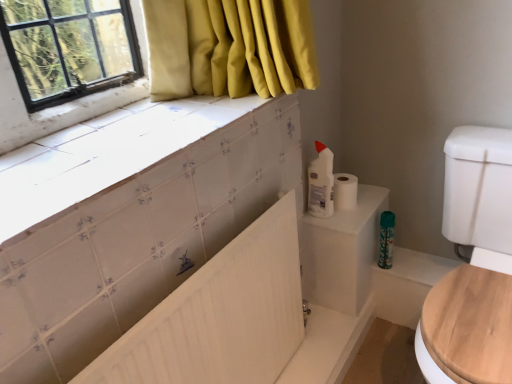
You are a GUI agent. You are given a task and a screenshot of the screen. Output one action in this format:
    pyautogui.click(x=<x>, y=<y>)
    Task: Click on the free space above white glossy tile at upper left (from a real-world perspective)
    
    Given the screenshot: What is the action you would take?
    pyautogui.click(x=137, y=146)